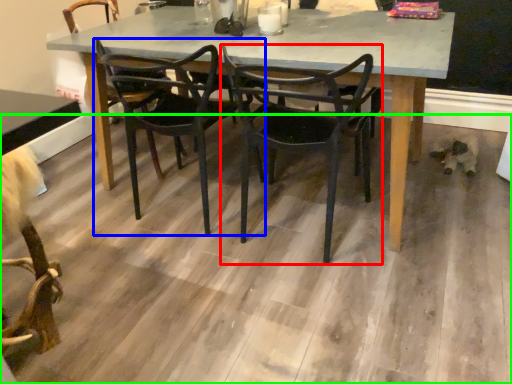
Question: Estimate the real-world distances between objects in this image. Which object is farther from chair (highlighted by a red box), chair (highlighted by a blue box) or concrete (highlighted by a green box)?

Choices:
 (A) chair
 (B) concrete

Answer: (B)